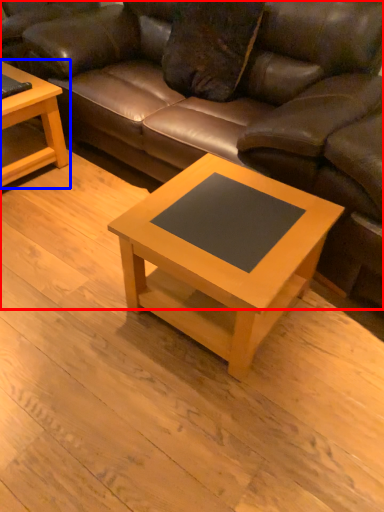
Question: Which point is closer to the camera, studio couch (highlighted by a red box) or coffee table (highlighted by a blue box)?

Choices:
 (A) studio couch
 (B) coffee table

Answer: (A)